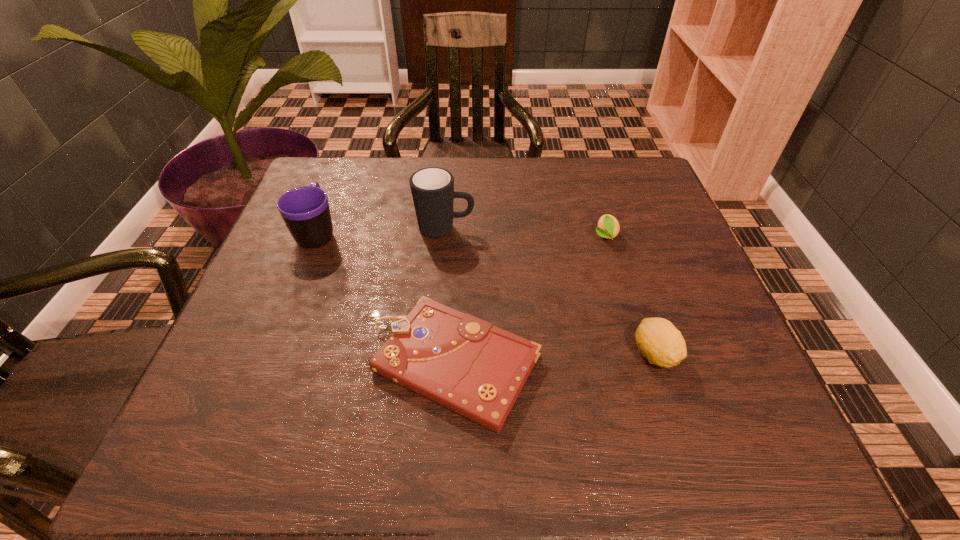
Image resolution: width=960 pixels, height=540 pixels. Find the location of `vacant area that lies between the farther lemon and the left mug`. vacant area that lies between the farther lemon and the left mug is located at coordinates (461, 234).

Locate an element on the screen. free spot between the farther lemon and the left mug is located at coordinates (461, 234).

In order to click on free space between the shortest object and the nearer lemon in this screenshot , I will do `click(555, 359)`.

The width and height of the screenshot is (960, 540). What are the coordinates of `vacant region between the shorter mug and the shortest object` in the screenshot? It's located at (387, 298).

The image size is (960, 540). What are the coordinates of `the third closest object relative to the nearer lemon` in the screenshot? It's located at (432, 188).

Find the location of `the fourth closest object to the leftmost object`. the fourth closest object to the leftmost object is located at coordinates (659, 341).

Find the location of `free location that satisfies the following two spatial constraints: 1. on the side of the shortest object with the handle; 2. on the right side of the taller mug`. free location that satisfies the following two spatial constraints: 1. on the side of the shortest object with the handle; 2. on the right side of the taller mug is located at coordinates (434, 363).

You are a GUI agent. You are given a task and a screenshot of the screen. Output one action in this format:
    pyautogui.click(x=<x>, y=<y>)
    Task: Click on the free location that satisfies the following two spatial constraints: 1. on the side of the shortest object with the handle; 2. on the left side of the tallest object
    The image size is (960, 540).
    Given the screenshot: What is the action you would take?
    pyautogui.click(x=434, y=363)